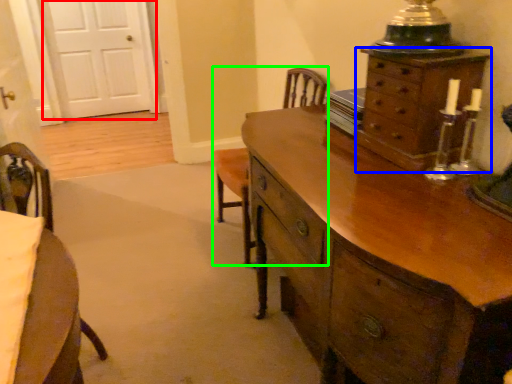
Question: Which object is positioned closest to door (highlighted by a red box)? Select from chest of drawers (highlighted by a blue box) and armchair (highlighted by a green box).

Choices:
 (A) chest of drawers
 (B) armchair

Answer: (B)